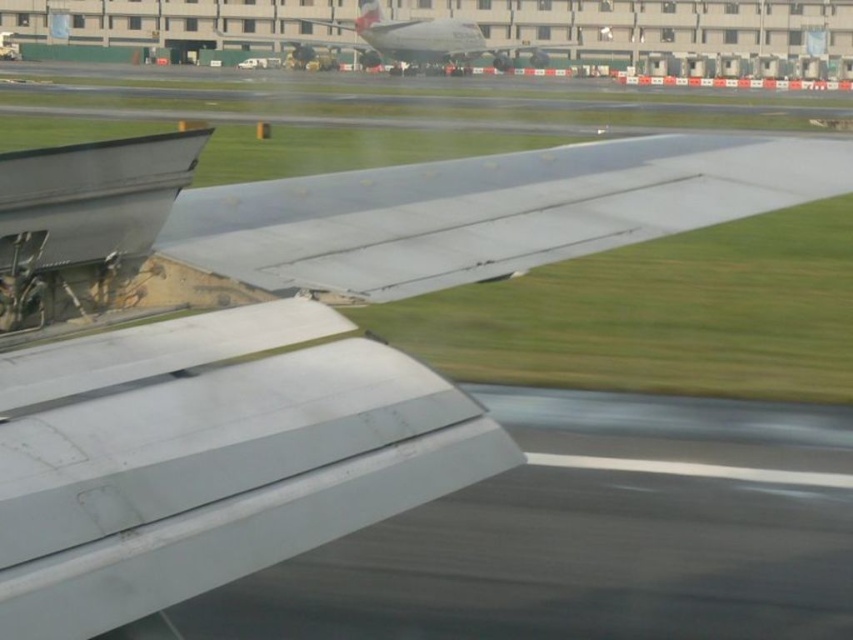
You are a passenger sitting in the front row of an airplane. You notice two objects near your feet on the left side of the aircraft. One is the gray matte tarmac at lower left, and the other is the metallic gray winglet at lower left. Which object is closer to you?

The gray matte tarmac at lower left is closer to you because it is further to the viewer than the metallic gray winglet at lower left, meaning it appears nearer in the perspective.

You are a pilot preparing for takeoff and need to ensure there is enough space between the gray matte tarmac at lower left and the white glossy airplane at center. Based on the scene, can you determine if there is sufficient clearance for the aircraft to maneuver safely?

The gray matte tarmac at lower left is positioned on the right side of the white glossy airplane at center, so there is enough clearance between them for the aircraft to maneuver safely during takeoff.